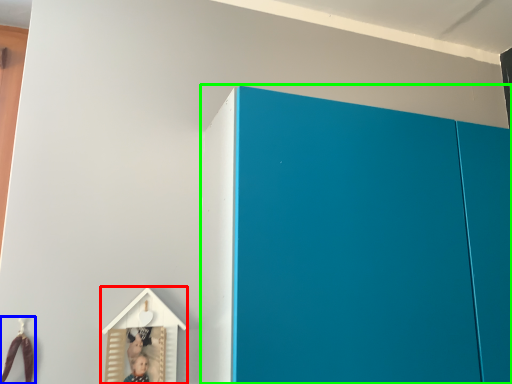
Question: Estimate the real-world distances between objects in this image. Which object is farther from toy (highlighted by a red box), toy (highlighted by a blue box) or cupboard (highlighted by a green box)?

Choices:
 (A) toy
 (B) cupboard

Answer: (B)